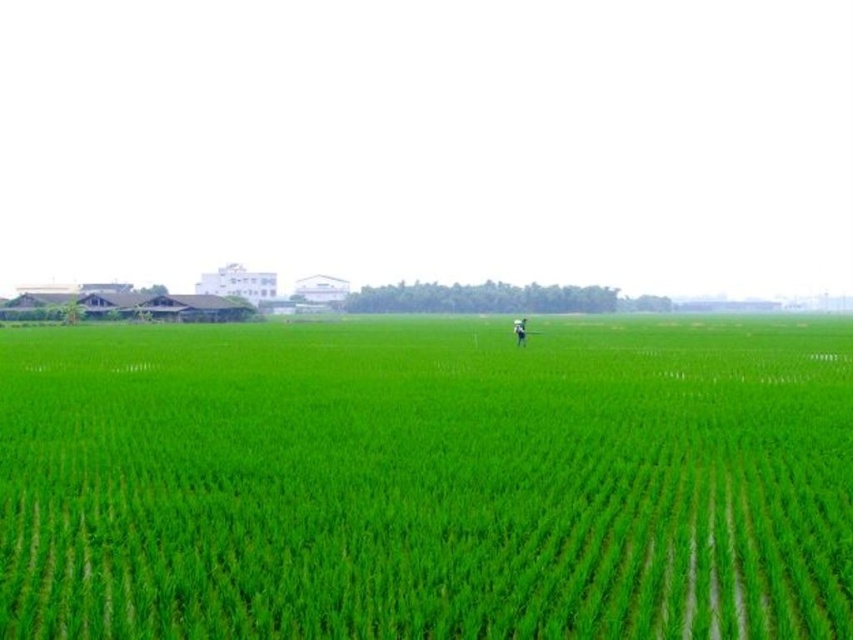
You are a GUI agent. You are given a task and a screenshot of the screen. Output one action in this format:
    pyautogui.click(x=<x>, y=<y>)
    Task: Click on the green grassy field at center
    The width and height of the screenshot is (853, 640).
    Given the screenshot: What is the action you would take?
    pyautogui.click(x=425, y=483)

Is green grassy field at center to the left of light blue fabric person at center from the viewer's perspective?

Yes, green grassy field at center is to the left of light blue fabric person at center.

Locate an element on the screen. green grassy field at center is located at coordinates (425, 483).